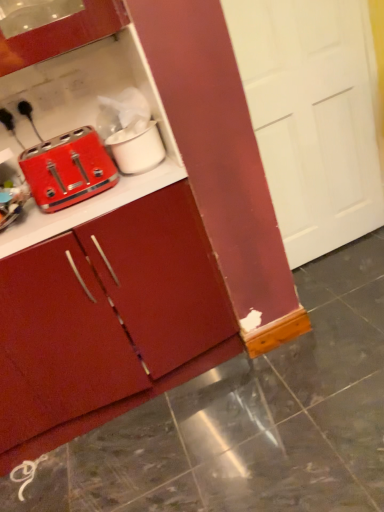
Find the location of a particular element. The height and width of the screenshot is (512, 384). matte red cabinet at center is located at coordinates (146, 302).

Image resolution: width=384 pixels, height=512 pixels. What do you see at coordinates (137, 149) in the screenshot?
I see `white matte pot at upper center` at bounding box center [137, 149].

You are a GUI agent. You are given a task and a screenshot of the screen. Output one action in this format:
    pyautogui.click(x=<x>, y=<y>)
    Task: Click on the white glossy tile at lower left
    Image resolution: width=384 pixels, height=512 pixels.
    Given the screenshot: What is the action you would take?
    pyautogui.click(x=37, y=485)

Where is `tile behind the white matte pot at upper center`? tile behind the white matte pot at upper center is located at coordinates (37, 485).

Consider the image. Is white matte pot at upper center bigger than white glossy tile at lower left?

Yes, white matte pot at upper center is bigger than white glossy tile at lower left.

From a real-world perspective, relative to white glossy tile at lower left, is white matte pot at upper center vertically above or below?

white matte pot at upper center is situated higher than white glossy tile at lower left in the real world.

Is matte red cabinet at center aimed at matte red toaster at left?

No, matte red cabinet at center is not aimed at matte red toaster at left.

This screenshot has width=384, height=512. Find the location of `cabinetry on the left of matte red toaster at left`. cabinetry on the left of matte red toaster at left is located at coordinates (146, 302).

Which object is wider, matte red cabinet at center or matte red toaster at left?

matte red cabinet at center.

Which of these two, matte red cabinet at center or white glossy tile at lower left, is bigger?

matte red cabinet at center.

From the picture: Is matte red cabinet at center to the left or to the right of white glossy tile at lower left in the image?

In the image, matte red cabinet at center appears on the right side of white glossy tile at lower left.

Locate an element on the screen. The width and height of the screenshot is (384, 512). tile below the matte red cabinet at center (from the image's perspective) is located at coordinates (37, 485).

How many degrees apart are the facing directions of matte red cabinet at center and white glossy tile at lower left?

matte red cabinet at center and white glossy tile at lower left are facing 1.59 degrees away from each other.

Could white glossy tile at lower left be considered to be inside matte red toaster at left?

Definitely not — white glossy tile at lower left is not inside matte red toaster at left.

Looking at this image, between matte red toaster at left and white glossy tile at lower left, which one has less height?

white glossy tile at lower left.

Is matte red toaster at left bigger than white glossy tile at lower left?

Indeed, matte red toaster at left has a larger size compared to white glossy tile at lower left.

From the picture: How different are the orientations of matte red toaster at left and white glossy tile at lower left in degrees?

There is a 7.11-degree angle between the facing directions of matte red toaster at left and white glossy tile at lower left.

How different are the orientations of white glossy tile at lower left and matte red cabinet at center in degrees?

1.59 degrees separate the facing orientations of white glossy tile at lower left and matte red cabinet at center.

Considering the sizes of objects white glossy tile at lower left and matte red cabinet at center in the image provided, who is taller, white glossy tile at lower left or matte red cabinet at center?

Standing taller between the two is matte red cabinet at center.

Is white glossy tile at lower left oriented towards matte red cabinet at center?

Yes, white glossy tile at lower left faces towards matte red cabinet at center.

Identify the location of tile on the left side of matte red cabinet at center. The image size is (384, 512). (37, 485).

Which object is further away from the camera taking this photo, matte red toaster at left or white matte pot at upper center?

white matte pot at upper center is behind.

Consider the image. Is white matte pot at upper center surrounded by matte red toaster at left?

That's incorrect, white matte pot at upper center is not inside matte red toaster at left.

Could you tell me if matte red toaster at left is turned towards white matte pot at upper center?

No, matte red toaster at left is not aimed at white matte pot at upper center.

Find the location of a particular element. The image size is (384, 512). toaster located above the white glossy tile at lower left (from the image's perspective) is located at coordinates tap(68, 169).

Looking at the image, does white glossy tile at lower left seem bigger or smaller compared to matte red toaster at left?

In the image, white glossy tile at lower left appears to be smaller than matte red toaster at left.

Which is closer, (55, 476) or (107, 189)?

Clearly, point (55, 476) is more distant from the camera than point (107, 189).

At what (x,y) coordinates should I click in order to perform the action: click on tile that appears on the left of white matte pot at upper center. Please return your answer as a coordinate pair (x, y). This screenshot has width=384, height=512. Looking at the image, I should click on (37, 485).

This screenshot has height=512, width=384. In the image, there is a matte red toaster at left. What are the coordinates of `cabinetry below it (from the image's perspective)` in the screenshot? It's located at (146, 302).

Which object lies further to the anchor point matte red cabinet at center, matte red toaster at left or white matte pot at upper center?

white matte pot at upper center lies further to matte red cabinet at center than the other object.

Which object lies further to the anchor point matte red cabinet at center, white glossy tile at lower left or white matte pot at upper center?

white glossy tile at lower left.

In the scene shown: Based on their spatial positions, is matte red toaster at left or matte red cabinet at center closer to white glossy tile at lower left?

matte red cabinet at center is positioned closer to the anchor white glossy tile at lower left.

Based on their spatial positions, is matte red cabinet at center or matte red toaster at left further from white glossy tile at lower left?

The object further to white glossy tile at lower left is matte red toaster at left.

From the picture: Based on their spatial positions, is matte red cabinet at center or white matte pot at upper center further from white glossy tile at lower left?

white matte pot at upper center is positioned further to the anchor white glossy tile at lower left.

Which object lies nearer to the anchor point white matte pot at upper center, matte red cabinet at center or matte red toaster at left?

matte red toaster at left lies closer to white matte pot at upper center than the other object.

From the image, which object appears to be farther from matte red toaster at left, matte red cabinet at center or white matte pot at upper center?

matte red cabinet at center is further to matte red toaster at left.

Considering their positions, is white glossy tile at lower left positioned further to white matte pot at upper center than matte red cabinet at center?

Among the two, white glossy tile at lower left is located further to white matte pot at upper center.

At what (x,y) coordinates should I click in order to perform the action: click on toaster between white matte pot at upper center and matte red cabinet at center from top to bottom. Please return your answer as a coordinate pair (x, y). Image resolution: width=384 pixels, height=512 pixels. Looking at the image, I should click on (68, 169).

What are the coordinates of `toaster that lies between white matte pot at upper center and white glossy tile at lower left from top to bottom` in the screenshot? It's located at (68, 169).

Identify the location of cabinetry between white matte pot at upper center and white glossy tile at lower left in the up-down direction. (146, 302).

At what (x,y) coordinates should I click in order to perform the action: click on cabinetry between matte red toaster at left and white glossy tile at lower left from top to bottom. Please return your answer as a coordinate pair (x, y). Image resolution: width=384 pixels, height=512 pixels. Looking at the image, I should click on (146, 302).